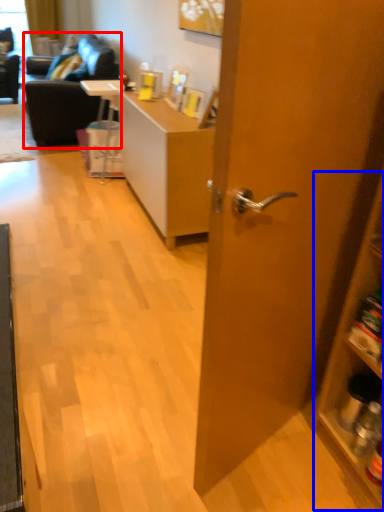
Question: Which object is further to the camera taking this photo, studio couch (highlighted by a red box) or cabinetry (highlighted by a blue box)?

Choices:
 (A) studio couch
 (B) cabinetry

Answer: (A)